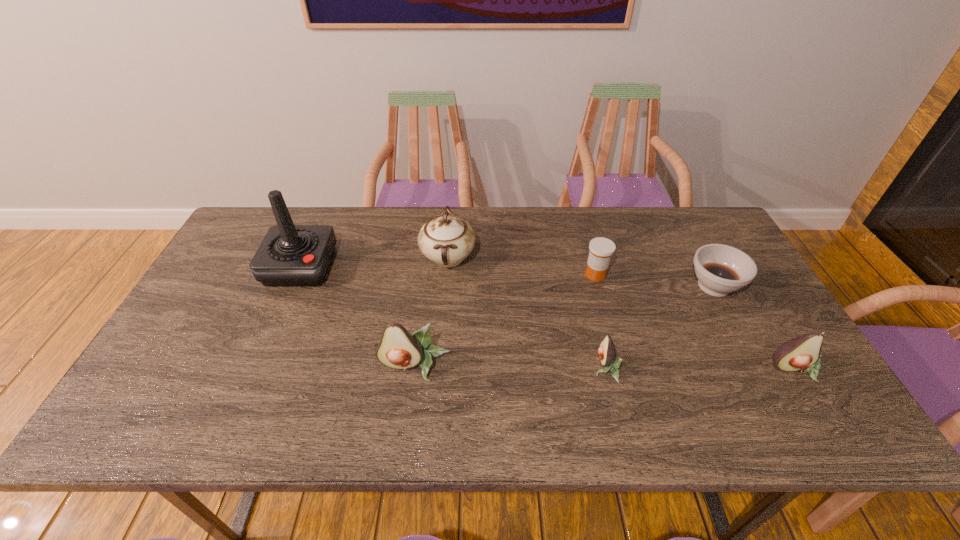
Find the location of a particular element. This screenshot has height=540, width=960. object at the far left corner is located at coordinates (289, 255).

The image size is (960, 540). I want to click on object at the near right corner, so click(x=801, y=353).

The width and height of the screenshot is (960, 540). What are the coordinates of `vacant space at the far edge of the desktop` in the screenshot? It's located at (368, 217).

Where is `vacant space at the near edge of the desktop`? vacant space at the near edge of the desktop is located at coordinates (351, 392).

The height and width of the screenshot is (540, 960). Find the location of `vacant region at the left edge of the desktop`. vacant region at the left edge of the desktop is located at coordinates (214, 291).

Locate an element on the screen. vacant region at the right edge is located at coordinates (720, 315).

The image size is (960, 540). What are the coordinates of `free space between the chinaware and the leftmost object` in the screenshot? It's located at (374, 262).

At what (x,y) coordinates should I click in order to perform the action: click on blank region between the second tallest avocado and the soup bowl. Please return your answer as a coordinate pair (x, y). This screenshot has height=540, width=960. Looking at the image, I should click on (755, 328).

You are a GUI agent. You are given a task and a screenshot of the screen. Output one action in this format:
    pyautogui.click(x=<x>, y=<y>)
    Task: Click on the empty space that is in between the leftmost object and the leftmost avocado
    The height and width of the screenshot is (540, 960).
    Given the screenshot: What is the action you would take?
    pyautogui.click(x=358, y=316)

Identify the location of empty location between the leftmost avocado and the medicine. The image size is (960, 540). (505, 321).